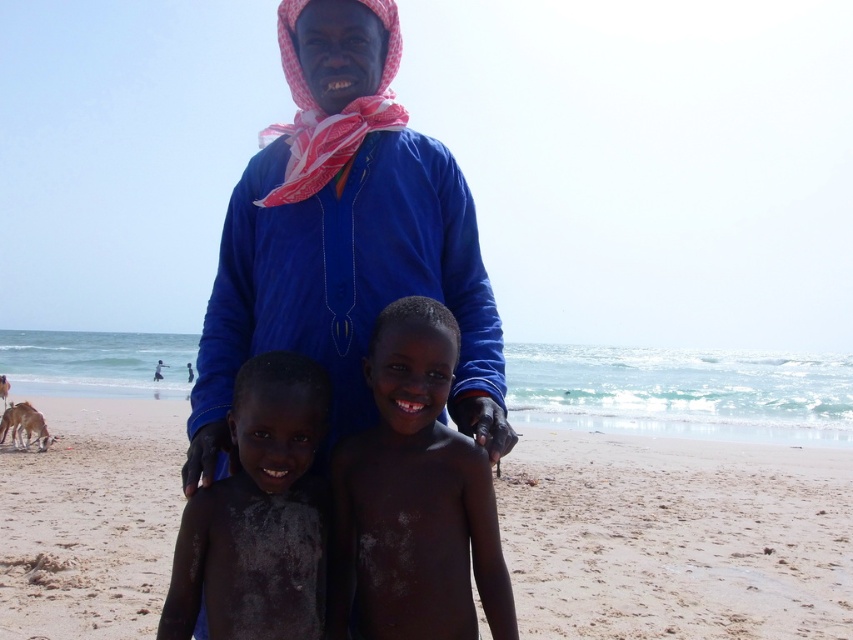
What are the coordinates of the sandy beach at center?

The coordinates of the sandy beach at center are at point (676, 536).